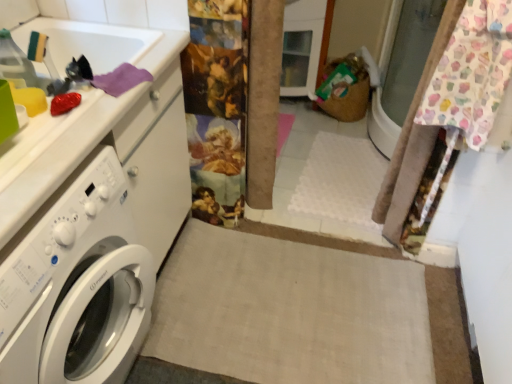
Identify the location of white glossy washing machine at left. The width and height of the screenshot is (512, 384). (76, 283).

What is the approximate height of white glossy washing machine at left?

white glossy washing machine at left is 31.92 inches in height.

What do you see at coordinates (76, 283) in the screenshot?
I see `white glossy washing machine at left` at bounding box center [76, 283].

The height and width of the screenshot is (384, 512). I want to click on white glossy washing machine at left, so click(76, 283).